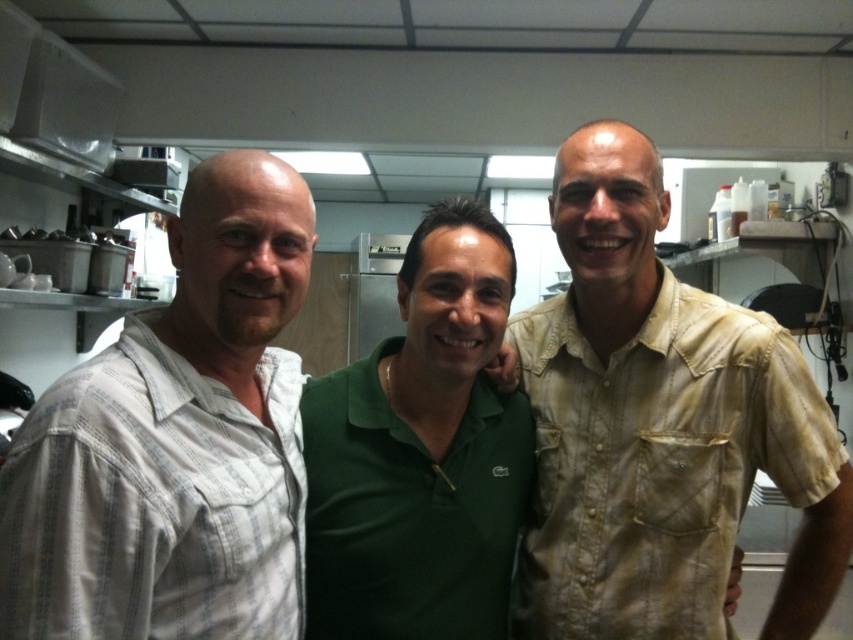
Question: Can you confirm if light beige striped shirt at left is positioned to the right of green polo shirt at center?

Choices:
 (A) yes
 (B) no

Answer: (B)

Question: Which of the following is the farthest from the observer?

Choices:
 (A) light beige striped shirt at left
 (B) green polo shirt at center
 (C) light brown textured shirt at right

Answer: (C)

Question: Is light brown textured shirt at right to the right of green polo shirt at center from the viewer's perspective?

Choices:
 (A) no
 (B) yes

Answer: (B)

Question: Which object appears farthest from the camera in this image?

Choices:
 (A) light beige striped shirt at left
 (B) green polo shirt at center
 (C) light brown textured shirt at right

Answer: (C)

Question: Which object is the closest to the light brown textured shirt at right?

Choices:
 (A) green polo shirt at center
 (B) light beige striped shirt at left

Answer: (A)

Question: Is light brown textured shirt at right wider than light beige striped shirt at left?

Choices:
 (A) yes
 (B) no

Answer: (A)